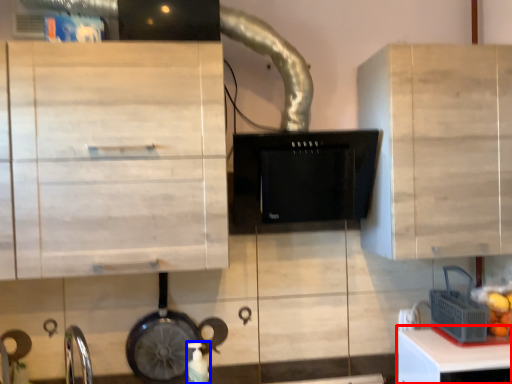
Question: Which of the following is the farthest to the observer, table (highlighted by a red box) or bottle (highlighted by a blue box)?

Choices:
 (A) table
 (B) bottle

Answer: (B)